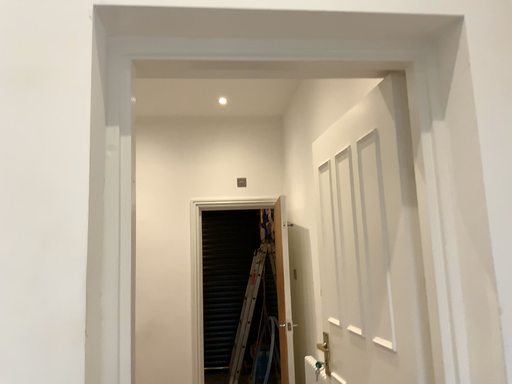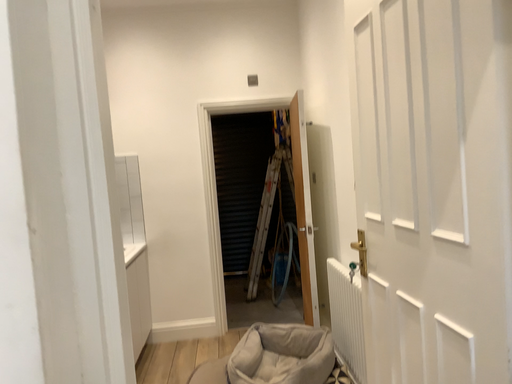
Question: Which way did the camera rotate in the video?

Choices:
 (A) rotated downward
 (B) rotated upward

Answer: (A)